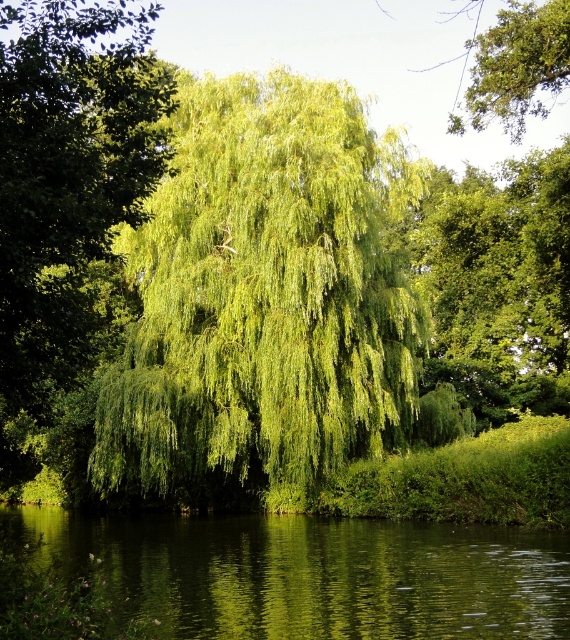
You are standing at the camera position and want to reach the point marked as point (136, 381). Is the distance more than 90 feet?

Yes, the distance between the camera and point (136, 381) is 93.59 feet, which is more than 90 feet.

You are a bird that wants to land on the green reflective water at center. The green leafy willow at center is in your flight path. Can you safely land on the water without hitting the tree?

The green leafy willow at center is 32.19 feet away from the green reflective water at center. Since the distance is sufficient, the bird can safely land on the water without hitting the tree.

You are standing at the center of the image. Which direction should you move to get closer to the green leafy willow at center?

The green leafy willow at center is already at the center of the image, so you don not need to move in any direction to get closer.